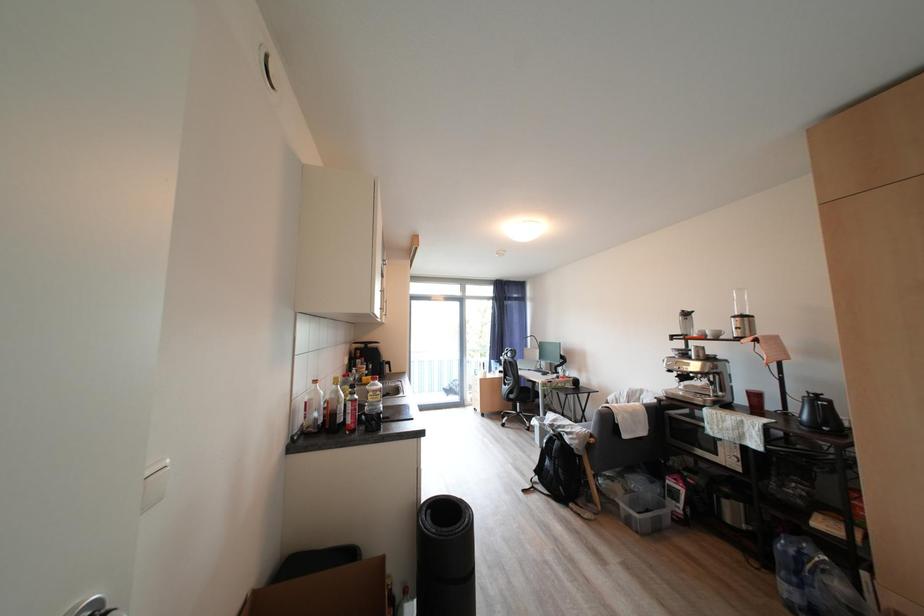
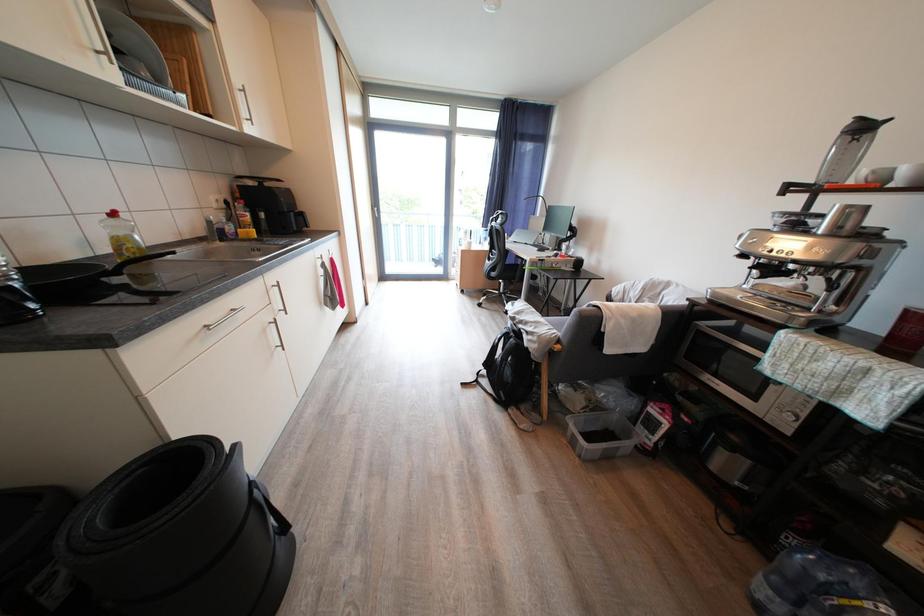
The images are taken continuously from a first-person perspective. In which direction are you moving?

The cameraman moved toward right, forward.